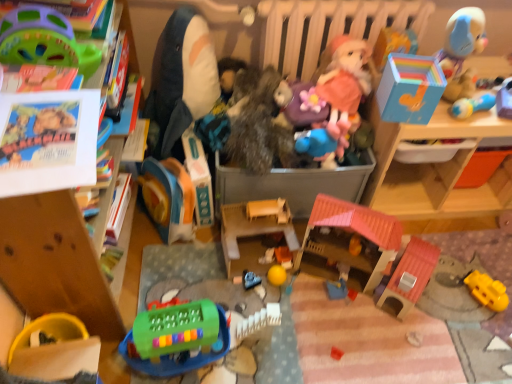
Question: Is blue rubber duck at center, placed as the 12th toy when sorted from left to right, wider than smooth orange block at center, the tenth toy positioned from the left?

Choices:
 (A) yes
 (B) no

Answer: (A)

Question: From a real-world perspective, is blue rubber duck at center, placed as the 5th toy when sorted from right to left, positioned over smooth orange block at center, the tenth toy positioned from the left, based on gravity?

Choices:
 (A) yes
 (B) no

Answer: (A)

Question: Can we say blue rubber duck at center, placed as the 5th toy when sorted from right to left, lies outside smooth orange block at center, arranged as the seventh toy when viewed from the right?

Choices:
 (A) yes
 (B) no

Answer: (A)

Question: Considering the relative positions of blue rubber duck at center, placed as the 12th toy when sorted from left to right, and smooth orange block at center, arranged as the seventh toy when viewed from the right, in the image provided, is blue rubber duck at center, placed as the 12th toy when sorted from left to right, to the left of smooth orange block at center, arranged as the seventh toy when viewed from the right, from the viewer's perspective?

Choices:
 (A) no
 (B) yes

Answer: (A)

Question: Is blue rubber duck at center, placed as the 5th toy when sorted from right to left, at the right side of smooth orange block at center, arranged as the seventh toy when viewed from the right?

Choices:
 (A) yes
 (B) no

Answer: (A)

Question: Is yellow rubber ball at center, the ninth toy when ordered from left to right, bigger or smaller than rubber yellow bowl at lower left, arranged as the first toy when viewed from the left?

Choices:
 (A) big
 (B) small

Answer: (B)

Question: Is yellow rubber ball at center, the ninth toy when ordered from left to right, situated inside rubber yellow bowl at lower left, acting as the sixteenth toy starting from the right, or outside?

Choices:
 (A) outside
 (B) inside

Answer: (A)

Question: Is point (274, 279) positioned closer to the camera than point (77, 364)?

Choices:
 (A) farther
 (B) closer

Answer: (A)

Question: In terms of height, does yellow rubber ball at center, acting as the eighth toy starting from the right, look taller or shorter compared to rubber yellow bowl at lower left, acting as the sixteenth toy starting from the right?

Choices:
 (A) tall
 (B) short

Answer: (B)

Question: Is point (326, 18) closer or farther from the camera than point (185, 339)?

Choices:
 (A) closer
 (B) farther

Answer: (B)

Question: Do you think wooden radiator at upper center is within green plastic keyboard at lower left, the 5th toy viewed from the left, or outside of it?

Choices:
 (A) inside
 (B) outside

Answer: (B)

Question: Based on their sizes in the image, would you say wooden radiator at upper center is bigger or smaller than green plastic keyboard at lower left, the 5th toy viewed from the left?

Choices:
 (A) big
 (B) small

Answer: (A)

Question: From the image's perspective, is wooden radiator at upper center positioned above or below green plastic keyboard at lower left, the twelfth toy viewed from the right?

Choices:
 (A) below
 (B) above

Answer: (B)

Question: From a real-world perspective, is smooth blue car at center, the eleventh toy in the right-to-left sequence, physically located above or below smooth plastic ball at upper right, marked as the 16th toy in a left-to-right arrangement?

Choices:
 (A) below
 (B) above

Answer: (A)

Question: Considering the positions of smooth blue car at center, the eleventh toy in the right-to-left sequence, and smooth plastic ball at upper right, marked as the first toy in a right-to-left arrangement, in the image, is smooth blue car at center, the eleventh toy in the right-to-left sequence, bigger or smaller than smooth plastic ball at upper right, marked as the first toy in a right-to-left arrangement,?

Choices:
 (A) big
 (B) small

Answer: (B)